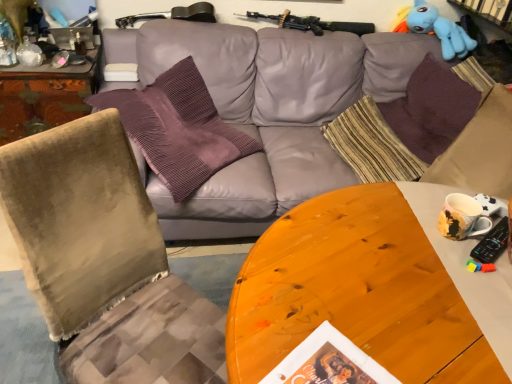
Question: Is gray leather couch at center positioned beyond the bounds of wooden desk at left?

Choices:
 (A) no
 (B) yes

Answer: (B)

Question: Is gray leather couch at center smaller than wooden desk at left?

Choices:
 (A) no
 (B) yes

Answer: (A)

Question: From a real-world perspective, is gray leather couch at center located higher than wooden desk at left?

Choices:
 (A) no
 (B) yes

Answer: (B)

Question: Does gray leather couch at center touch wooden desk at left?

Choices:
 (A) yes
 (B) no

Answer: (B)

Question: Can you confirm if gray leather couch at center is bigger than wooden desk at left?

Choices:
 (A) yes
 (B) no

Answer: (A)

Question: Is purple knitted pillow at upper right, which appears as the fourth pillow when viewed from the left, taller or shorter than striped fabric pillow at center, which ranks as the second pillow in left-to-right order?

Choices:
 (A) tall
 (B) short

Answer: (A)

Question: Based on their positions, is purple knitted pillow at upper right, arranged as the first pillow when viewed from the right, located to the left or right of striped fabric pillow at center, which appears as the third pillow when viewed from the right?

Choices:
 (A) left
 (B) right

Answer: (B)

Question: From a real-world perspective, is purple knitted pillow at upper right, arranged as the first pillow when viewed from the right, above or below striped fabric pillow at center, which appears as the third pillow when viewed from the right?

Choices:
 (A) below
 (B) above

Answer: (B)

Question: From the image's perspective, relative to striped fabric pillow at center, which appears as the third pillow when viewed from the right, is purple knitted pillow at upper right, arranged as the first pillow when viewed from the right, above or below?

Choices:
 (A) below
 (B) above

Answer: (B)

Question: From a real-world perspective, is velvet green chair at left physically located above or below purple knitted pillow at upper right, which appears as the fourth pillow when viewed from the left?

Choices:
 (A) above
 (B) below

Answer: (B)

Question: Is point (61, 167) closer or farther from the camera than point (436, 145)?

Choices:
 (A) closer
 (B) farther

Answer: (A)

Question: Is velvet green chair at left inside or outside of purple knitted pillow at upper right, which appears as the fourth pillow when viewed from the left?

Choices:
 (A) outside
 (B) inside

Answer: (A)

Question: Relative to purple knitted pillow at upper right, arranged as the first pillow when viewed from the right, is velvet green chair at left in front or behind?

Choices:
 (A) behind
 (B) front

Answer: (B)

Question: Visually, is purple velvet pillow at upper left, which is the first pillow from left to right, positioned to the left or to the right of striped fabric pillow at center, which appears as the third pillow when viewed from the right?

Choices:
 (A) left
 (B) right

Answer: (A)

Question: From a real-world perspective, is purple velvet pillow at upper left, the 4th pillow from the right, above or below striped fabric pillow at center, which appears as the third pillow when viewed from the right?

Choices:
 (A) above
 (B) below

Answer: (A)